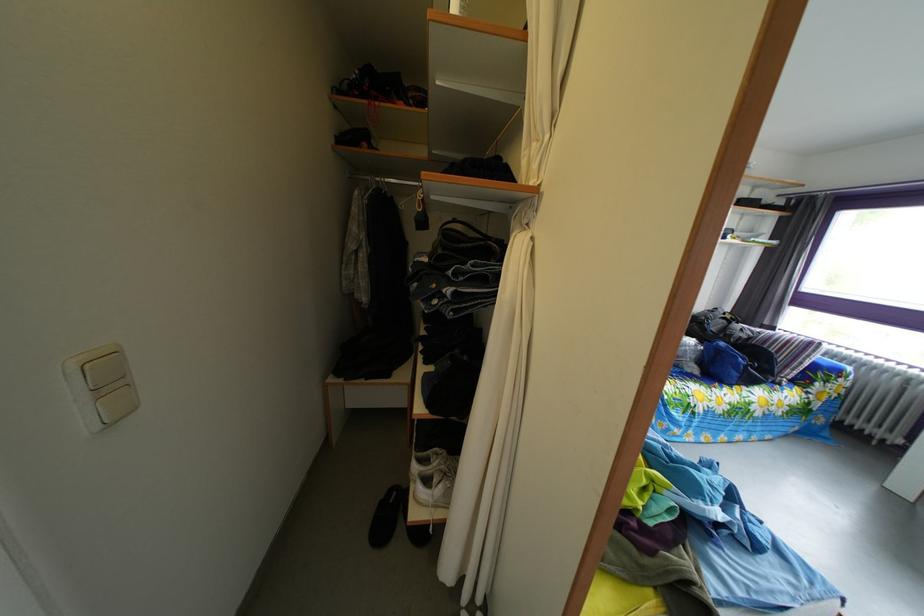
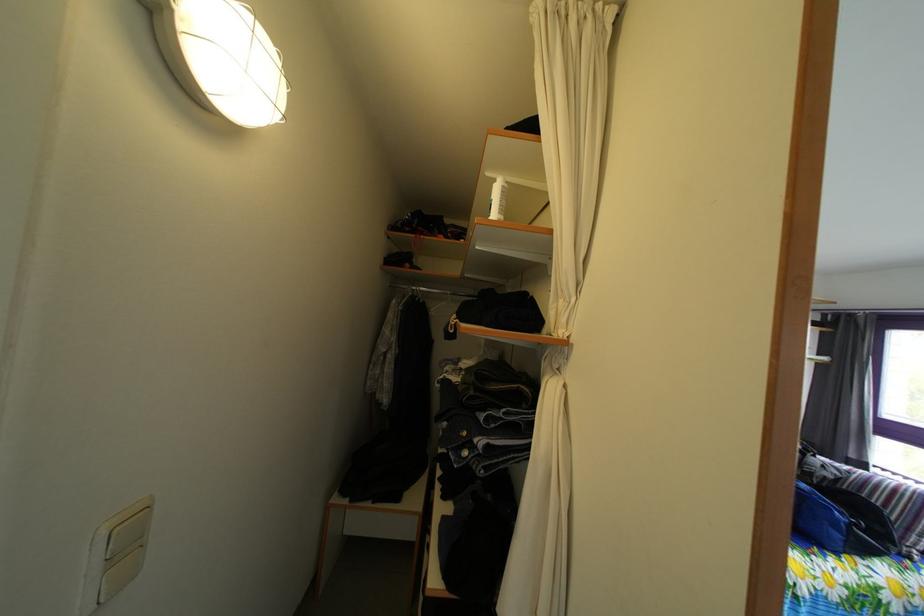
In the second image, find the point that corresponds to pixel 380 187 in the first image.

(418, 294)